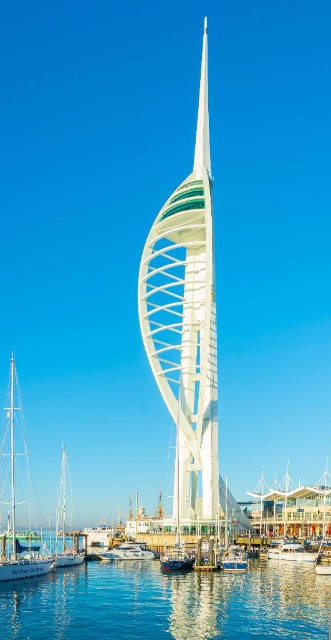
Can you confirm if white glossy boat at center is positioned above blue glossy sailboat at center?

Actually, white glossy boat at center is below blue glossy sailboat at center.

Who is more forward, (123, 557) or (175, 561)?

Point (175, 561) is more forward.

The width and height of the screenshot is (331, 640). I want to click on white glossy boat at center, so 128,552.

Can you confirm if blue liquid water at lower center is positioned above blue glossy sailboat at center?

Actually, blue liquid water at lower center is below blue glossy sailboat at center.

The height and width of the screenshot is (640, 331). What do you see at coordinates (168, 604) in the screenshot? I see `blue liquid water at lower center` at bounding box center [168, 604].

Locate an element on the screen. The width and height of the screenshot is (331, 640). blue liquid water at lower center is located at coordinates (168, 604).

Which of these two, white sailboat at left or white glossy sailboat at center, stands taller?

white sailboat at left is taller.

Does white sailboat at left appear on the left side of white glossy sailboat at center?

Indeed, white sailboat at left is positioned on the left side of white glossy sailboat at center.

Image resolution: width=331 pixels, height=640 pixels. Find the location of `white sailboat at left`. white sailboat at left is located at coordinates (65, 522).